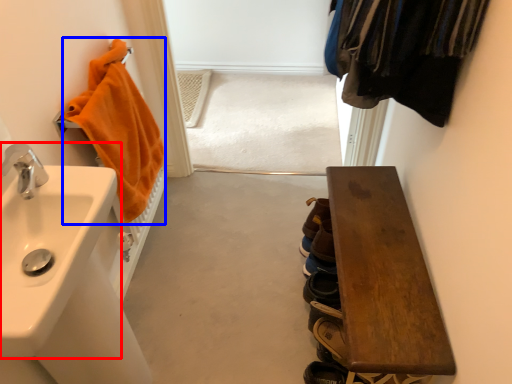
Question: Which of the following is the closest to the observer, sink (highlighted by a red box) or bath towel (highlighted by a blue box)?

Choices:
 (A) sink
 (B) bath towel

Answer: (A)